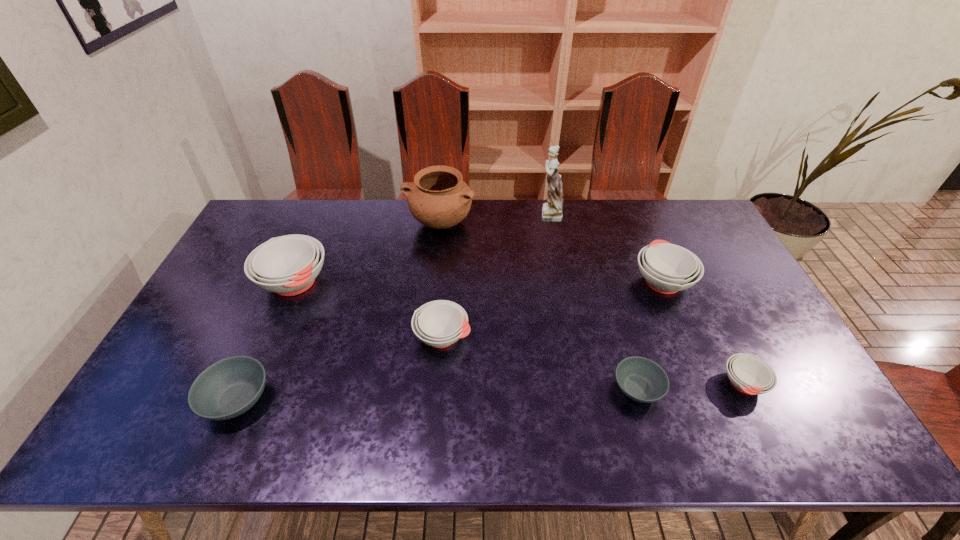
Identify the location of vacant space situated on the left of the third biggest white soup bowl. (279, 336).

At what (x,y) coordinates should I click in order to perform the action: click on vacant region located on the back of the left gray soup bowl. Please return your answer as a coordinate pair (x, y). Looking at the image, I should click on (262, 342).

Identify the location of vacant space located 0.170m on the back of the smallest white soup bowl. The image size is (960, 540). (709, 315).

You are a GUI agent. You are given a task and a screenshot of the screen. Output one action in this format:
    pyautogui.click(x=<x>, y=<y>)
    Task: Click on the vacant space located on the front of the third soup bowl from right to left
    
    Given the screenshot: What is the action you would take?
    pyautogui.click(x=655, y=448)

This screenshot has width=960, height=540. I want to click on figurine present at the far edge, so click(x=552, y=211).

This screenshot has height=540, width=960. I want to click on pottery at the far edge, so click(x=438, y=198).

At what (x,y) coordinates should I click in order to perform the action: click on object that is at the near edge. Please return your answer as a coordinate pair (x, y). Looking at the image, I should click on (228, 388).

Identify the location of object at the right edge. The height and width of the screenshot is (540, 960). (748, 374).

The width and height of the screenshot is (960, 540). Identify the location of object located in the near left corner section of the desktop. (228, 388).

Identify the location of vacant space at the far edge. The image size is (960, 540). (347, 212).